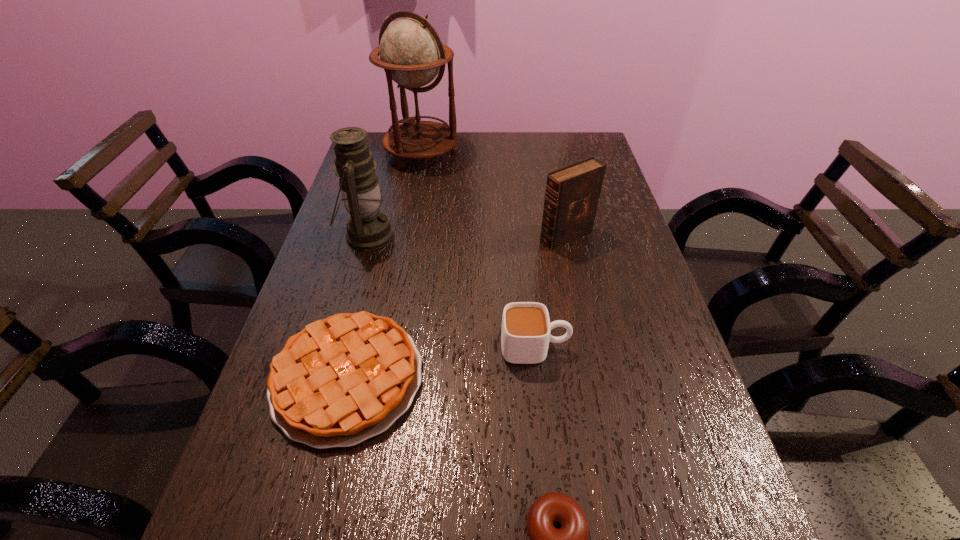
Image resolution: width=960 pixels, height=540 pixels. I want to click on free space between the farthest object and the third tallest object, so click(x=493, y=195).

At what (x,y) coordinates should I click in order to perform the action: click on vacant region between the farthest object and the pie. Please return your answer as a coordinate pair (x, y). Image resolution: width=960 pixels, height=540 pixels. Looking at the image, I should click on (385, 266).

Identify the location of vacant space that's between the tallest object and the Bible. This screenshot has height=540, width=960. (493, 195).

I want to click on free space between the farthest object and the cup, so click(x=478, y=251).

Locate an element on the screen. The height and width of the screenshot is (540, 960). free space between the second shortest object and the fourth shortest object is located at coordinates (457, 307).

I want to click on unoccupied area between the fourth tallest object and the globe, so click(478, 251).

Identify the location of free space between the fourth tallest object and the globe. This screenshot has width=960, height=540. (478, 251).

Find the location of a particular element. free spot between the oil lamp and the cup is located at coordinates (451, 292).

The height and width of the screenshot is (540, 960). In order to click on the fourth closest object relative to the fifth shortest object in this screenshot , I will do `click(572, 194)`.

Identify the location of the closest object to the cup. (342, 380).